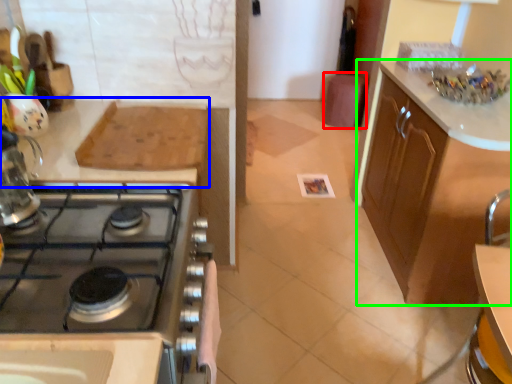
Question: Which object is the closest to the bar stool (highlighted by a red box)? Choose among these: countertop (highlighted by a blue box) or cabinetry (highlighted by a green box).

Choices:
 (A) countertop
 (B) cabinetry

Answer: (B)